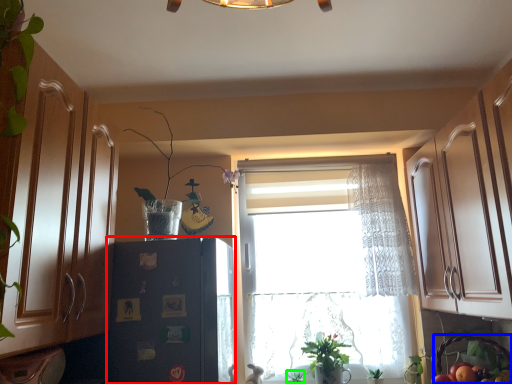
Question: Estimate the real-world distances between objects in this image. Which object is closer to fridge (highlighted by a red box), basket (highlighted by a blue box) or plant (highlighted by a green box)?

Choices:
 (A) basket
 (B) plant

Answer: (B)